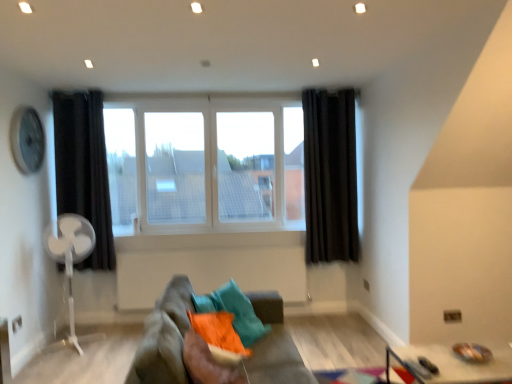
Question: Is metallic silver tray at lower right completely or partially inside black fabric curtain at right, the 1th curtain in the right-to-left sequence?

Choices:
 (A) yes
 (B) no

Answer: (B)

Question: Is black fabric curtain at right, the 1th curtain in the right-to-left sequence, to the right of metallic silver tray at lower right from the viewer's perspective?

Choices:
 (A) yes
 (B) no

Answer: (B)

Question: Does black fabric curtain at right, the 1th curtain in the right-to-left sequence, appear on the left side of metallic silver tray at lower right?

Choices:
 (A) yes
 (B) no

Answer: (A)

Question: Does black fabric curtain at right, the 1th curtain in the right-to-left sequence, have a smaller size compared to metallic silver tray at lower right?

Choices:
 (A) yes
 (B) no

Answer: (A)

Question: Is black fabric curtain at right, the 1th curtain in the right-to-left sequence, shorter than metallic silver tray at lower right?

Choices:
 (A) yes
 (B) no

Answer: (B)

Question: Relative to metallic silver tray at lower right, is metallic silver clock at upper left in front or behind?

Choices:
 (A) behind
 (B) front

Answer: (A)

Question: Looking at their shapes, would you say metallic silver clock at upper left is wider or thinner than metallic silver tray at lower right?

Choices:
 (A) wide
 (B) thin

Answer: (B)

Question: Is metallic silver clock at upper left inside the boundaries of metallic silver tray at lower right, or outside?

Choices:
 (A) outside
 (B) inside

Answer: (A)

Question: From a real-world perspective, is metallic silver clock at upper left physically located above or below metallic silver tray at lower right?

Choices:
 (A) above
 (B) below

Answer: (A)

Question: Based on their positions, is metallic silver tray at lower right located to the left or right of black fabric curtain at left, positioned as the second curtain in right-to-left order?

Choices:
 (A) left
 (B) right

Answer: (B)

Question: Considering the positions of point (468, 375) and point (54, 160), is point (468, 375) closer or farther from the camera than point (54, 160)?

Choices:
 (A) closer
 (B) farther

Answer: (A)

Question: Is metallic silver tray at lower right wider or thinner than black fabric curtain at left, positioned as the second curtain in right-to-left order?

Choices:
 (A) wide
 (B) thin

Answer: (A)

Question: Is metallic silver tray at lower right taller or shorter than black fabric curtain at left, positioned as the second curtain in right-to-left order?

Choices:
 (A) short
 (B) tall

Answer: (A)

Question: Based on their positions, is white glass window at center located to the left or right of metallic silver clock at upper left?

Choices:
 (A) right
 (B) left

Answer: (A)

Question: In terms of height, does white glass window at center look taller or shorter compared to metallic silver clock at upper left?

Choices:
 (A) short
 (B) tall

Answer: (B)